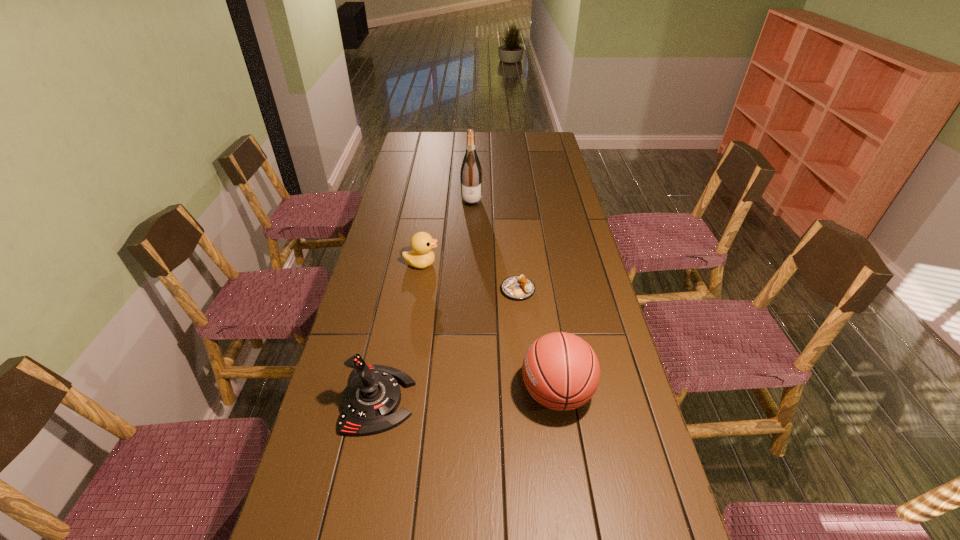
Where is `vacant point at the right edge`? This screenshot has width=960, height=540. vacant point at the right edge is located at coordinates (549, 184).

Image resolution: width=960 pixels, height=540 pixels. In order to click on vacant area between the farthest object and the fourth nearest object in this screenshot , I will do `click(446, 233)`.

Find the location of a particular element. The image size is (960, 540). free space between the duck and the pastry is located at coordinates (469, 277).

Image resolution: width=960 pixels, height=540 pixels. Find the location of `vacant point located between the pastry and the joystick`. vacant point located between the pastry and the joystick is located at coordinates (448, 345).

At what (x,y) coordinates should I click in order to perform the action: click on free space between the tallest object and the joystick. Please return your answer as a coordinate pair (x, y). Looking at the image, I should click on (424, 301).

The width and height of the screenshot is (960, 540). I want to click on vacant point located between the joystick and the duck, so click(x=399, y=332).

What are the coordinates of `vacant area that lies between the basketball and the joystick` in the screenshot? It's located at (468, 396).

Find the location of `blank region between the farthest object and the joystick`. blank region between the farthest object and the joystick is located at coordinates (424, 301).

This screenshot has width=960, height=540. I want to click on vacant space in between the third nearest object and the joystick, so click(448, 345).

Identify which object is located as the second nearest to the joystick. Please provide its 2D coordinates. Your answer should be formatted as a tuple, i.e. [(x, y)], where the tuple contains the x and y coordinates of a point satisfying the conditions above.

[(516, 287)]